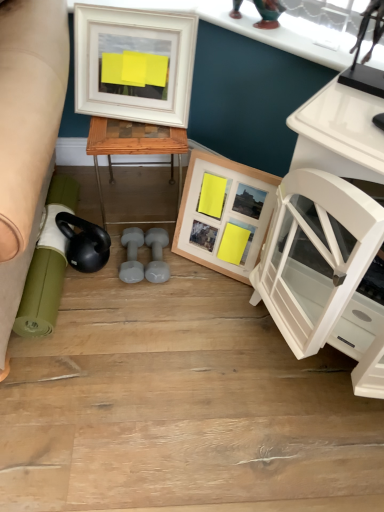
Find the location of `unoccupied space behind green rubber mat at lower left`. unoccupied space behind green rubber mat at lower left is located at coordinates (126, 189).